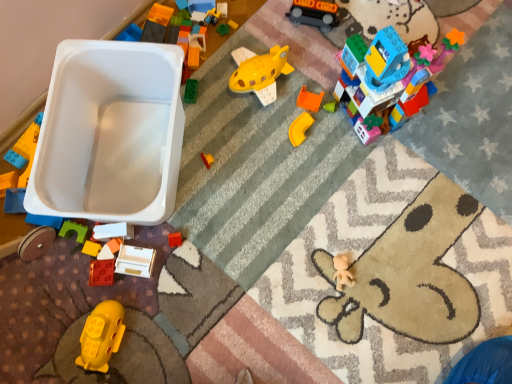
Identify the location of vacant region in front of matte white drawer at lower center, which ranks as the third toy in bottom-to-top order. This screenshot has height=384, width=512. (141, 326).